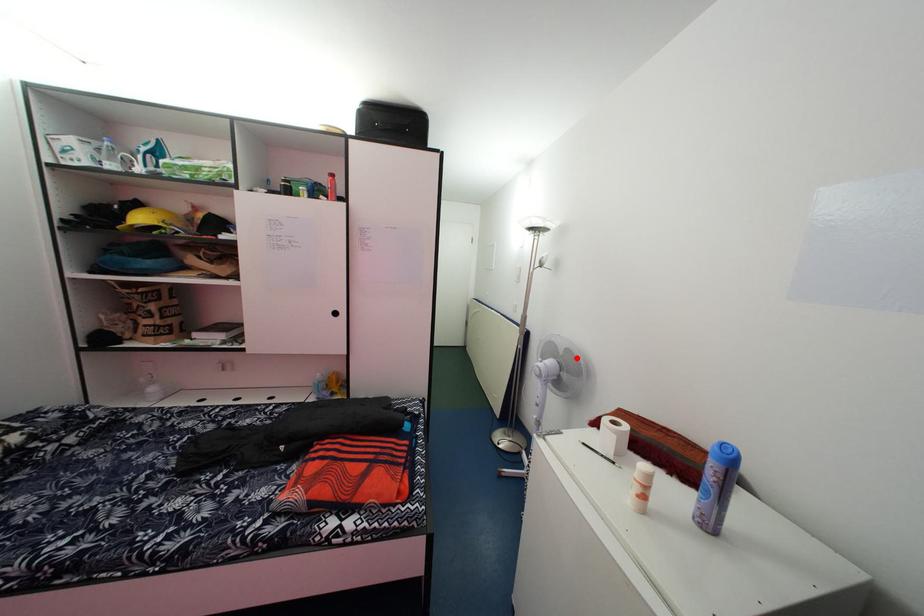
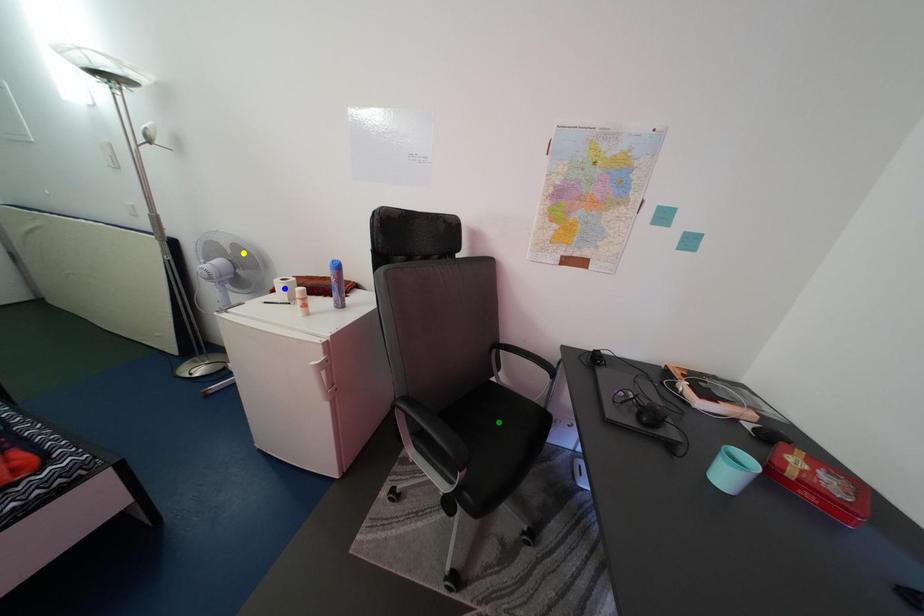
Question: I am providing you with two images of the same scene from different viewpoints. A red point is marked on the first image. You are given multiple points on the second image. Which spot in image 2 lines up with the point in image 1?

Choices:
 (A) green point
 (B) blue point
 (C) yellow point

Answer: (C)